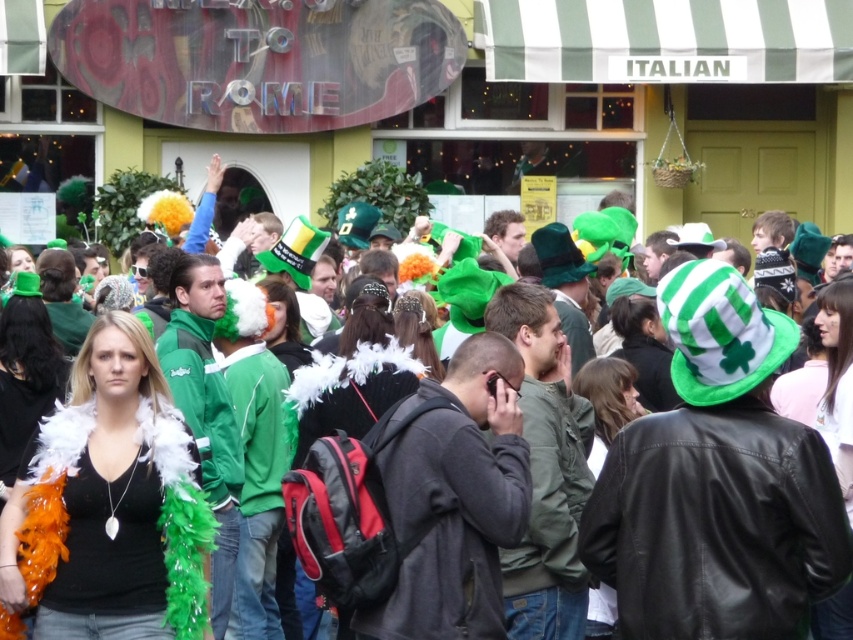
Question: Which object is the closest to the white feather boa at center?

Choices:
 (A) black feather boa at center
 (B) feather boa at center

Answer: (B)

Question: Can you confirm if black feather boa at center is bigger than feather boa at center?

Choices:
 (A) no
 (B) yes

Answer: (A)

Question: Does feather boa at center have a smaller size compared to white feather boa at center?

Choices:
 (A) no
 (B) yes

Answer: (A)

Question: Which point is closer to the camera?

Choices:
 (A) 398,378
 (B) 418,352
 (C) 73,381

Answer: (C)

Question: Which of the following is the closest to the observer?

Choices:
 (A) (381, 408)
 (B) (78, 417)
 (C) (431, 337)

Answer: (B)

Question: Does black feather boa at center appear under white feather boa at center?

Choices:
 (A) no
 (B) yes

Answer: (B)